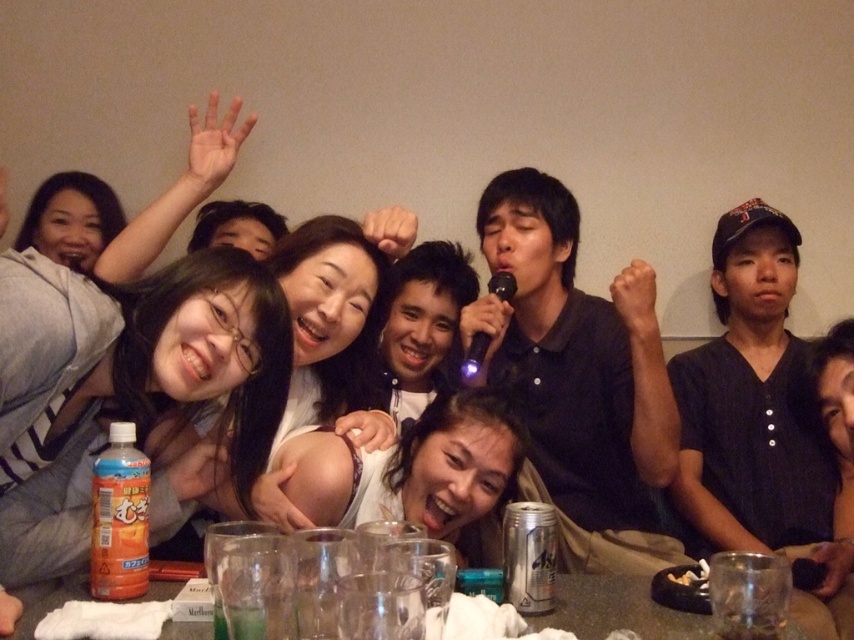
Question: Which object is the closest to the matte black hair at center?

Choices:
 (A) white matte shirt at center
 (B) clear glass table at lower center
 (C) smooth white shirt at center
 (D) black matte microphone at center

Answer: (A)

Question: Is matte black hair at center wider than clear glass table at lower center?

Choices:
 (A) yes
 (B) no

Answer: (A)

Question: Which point is closer to the camera taking this photo?

Choices:
 (A) (589, 416)
 (B) (319, 417)
 (C) (459, 422)

Answer: (C)

Question: In this image, where is black matte microphone at center located relative to white matte shirt at center?

Choices:
 (A) right
 (B) left

Answer: (A)

Question: Estimate the real-world distances between objects in this image. Which object is closer to the matte black hair at center?

Choices:
 (A) clear glass table at lower center
 (B) white matte shirt at center
 (C) black matte microphone at center

Answer: (B)

Question: Does black matte microphone at center appear over clear glass table at lower center?

Choices:
 (A) yes
 (B) no

Answer: (A)